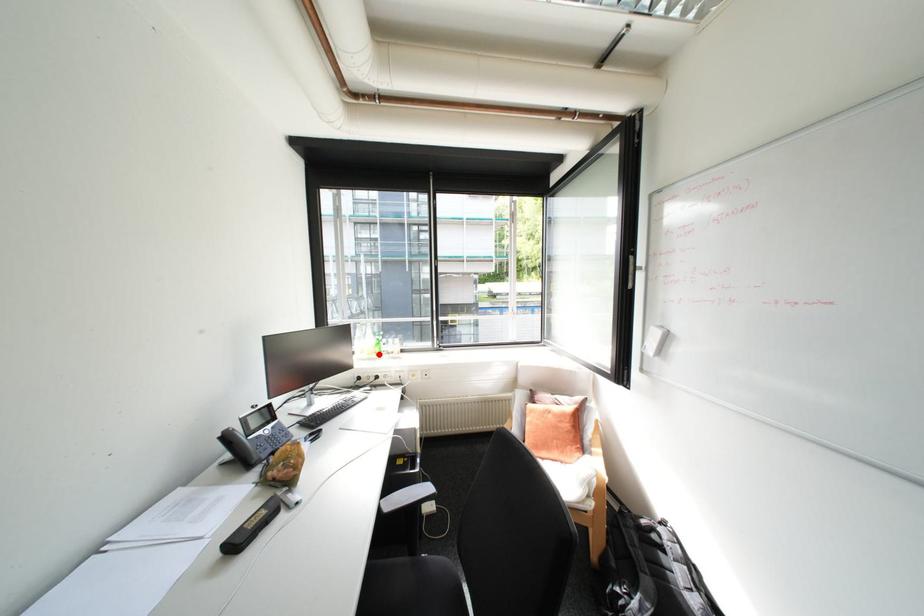
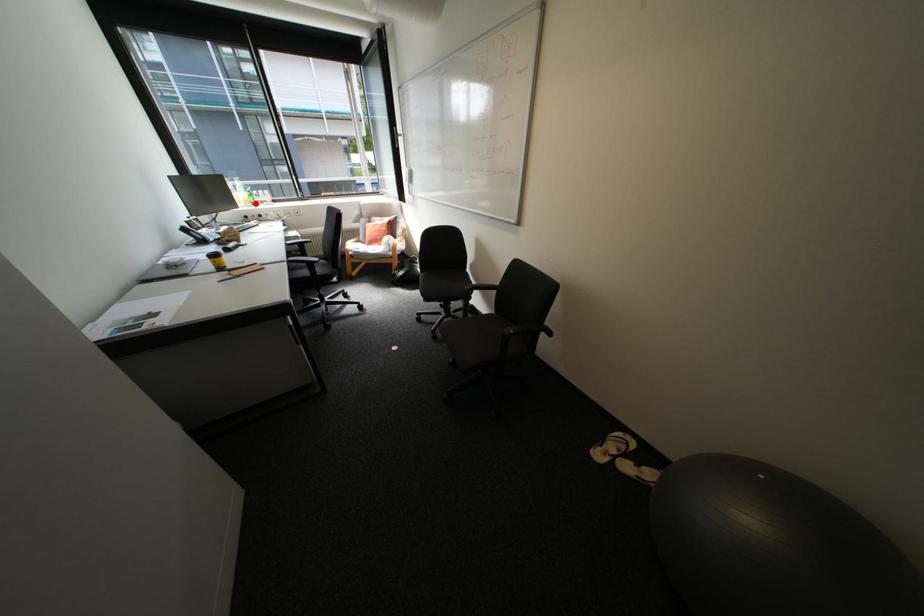
I am providing you with two images of the same scene from different viewpoints. A red point is marked on the first image and another point is marked on the second image. Does the point marked in image1 correspond to the same location as the one in image2?

Yes